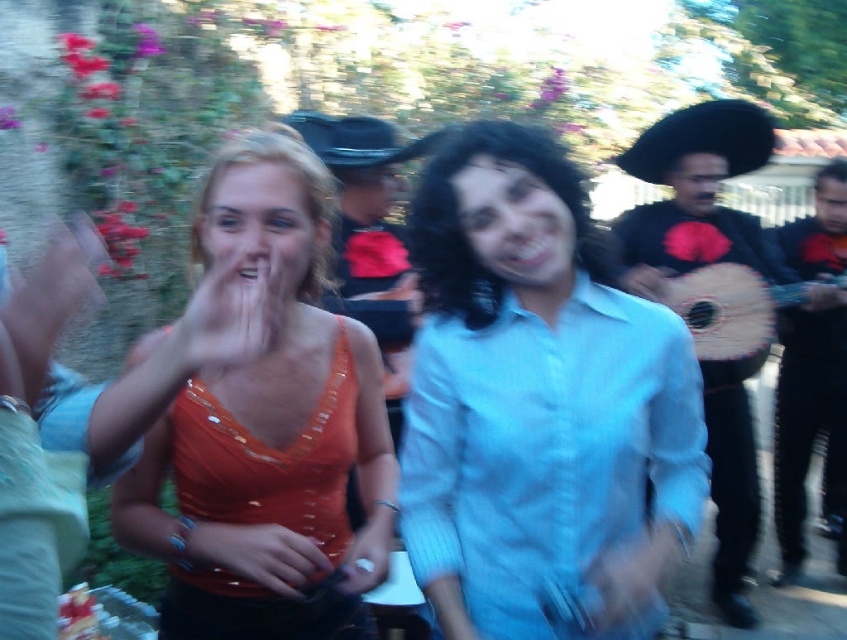
Measure the distance between point (292, 195) and camera.

Point (292, 195) and camera are 1.68 meters apart.

Which is more to the right, orange sequined top at left or black leather guitar at right?

From the viewer's perspective, black leather guitar at right appears more on the right side.

Measure the distance between point (305, 444) and camera.

The distance of point (305, 444) from camera is 5.57 feet.

This screenshot has height=640, width=847. In order to click on orange sequined top at left in this screenshot , I will do `click(268, 432)`.

Can you confirm if light blue cotton shirt at center is taller than black leather guitar at right?

In fact, light blue cotton shirt at center may be shorter than black leather guitar at right.

Does light blue cotton shirt at center appear over black leather guitar at right?

Incorrect, light blue cotton shirt at center is not positioned above black leather guitar at right.

I want to click on light blue cotton shirt at center, so click(547, 454).

The width and height of the screenshot is (847, 640). I want to click on light blue cotton shirt at center, so click(x=547, y=454).

Between orange sequined top at left and wooden acoustic guitar at center, which one is positioned lower?

Positioned lower is orange sequined top at left.

Is orange sequined top at left thinner than wooden acoustic guitar at center?

Yes.

Does point (255, 176) lie in front of point (778, 291)?

Yes, point (255, 176) is closer to viewer.

Where is `orange sequined top at left`? Image resolution: width=847 pixels, height=640 pixels. orange sequined top at left is located at coordinates (268, 432).